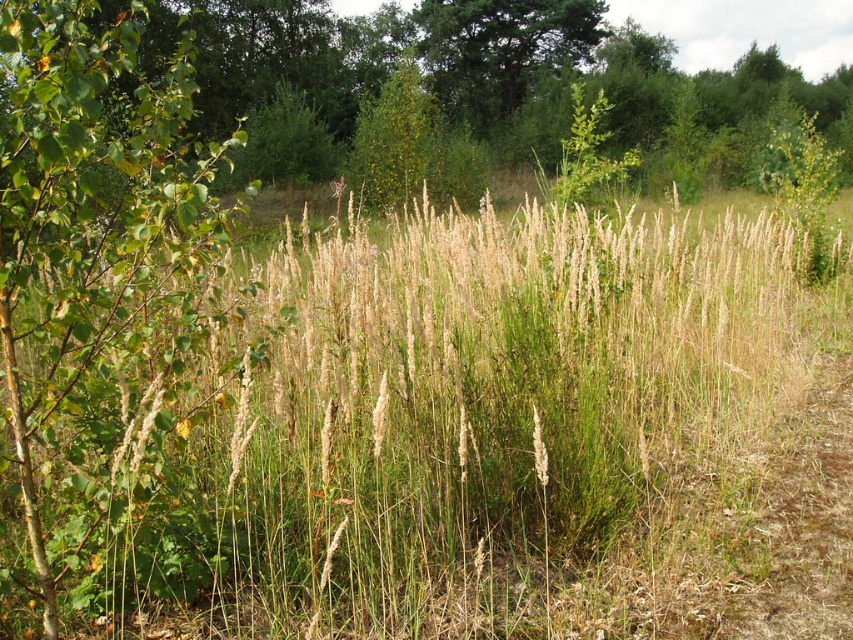
Question: Which point is farther to the camera?

Choices:
 (A) dry grass at center
 (B) green leafy tree at left

Answer: (B)

Question: Is dry grass at center positioned behind green leafy tree at left?

Choices:
 (A) no
 (B) yes

Answer: (A)

Question: Which of the following is the closest to the observer?

Choices:
 (A) dry grass at center
 (B) green leafy tree at left

Answer: (A)

Question: Is dry grass at center positioned before green leafy tree at left?

Choices:
 (A) no
 (B) yes

Answer: (B)

Question: Is dry grass at center closer to camera compared to green leafy tree at left?

Choices:
 (A) yes
 (B) no

Answer: (A)